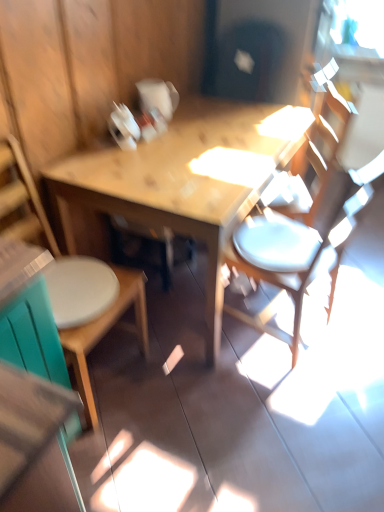
Where is `vacant area that is situated to the right of white matte chair at right, which ranks as the 2th chair in left-to-right order`? The height and width of the screenshot is (512, 384). vacant area that is situated to the right of white matte chair at right, which ranks as the 2th chair in left-to-right order is located at coordinates (357, 324).